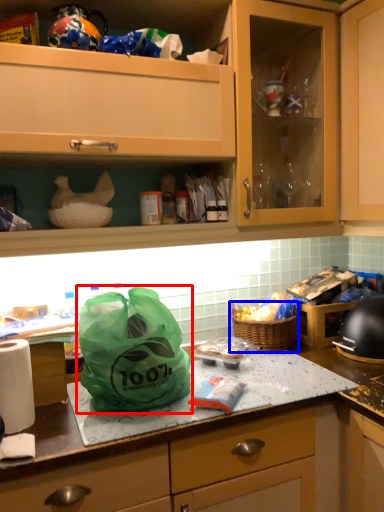
Question: Which of the following is the farthest to the observer, plastic bag (highlighted by a red box) or picnic basket (highlighted by a blue box)?

Choices:
 (A) plastic bag
 (B) picnic basket

Answer: (B)